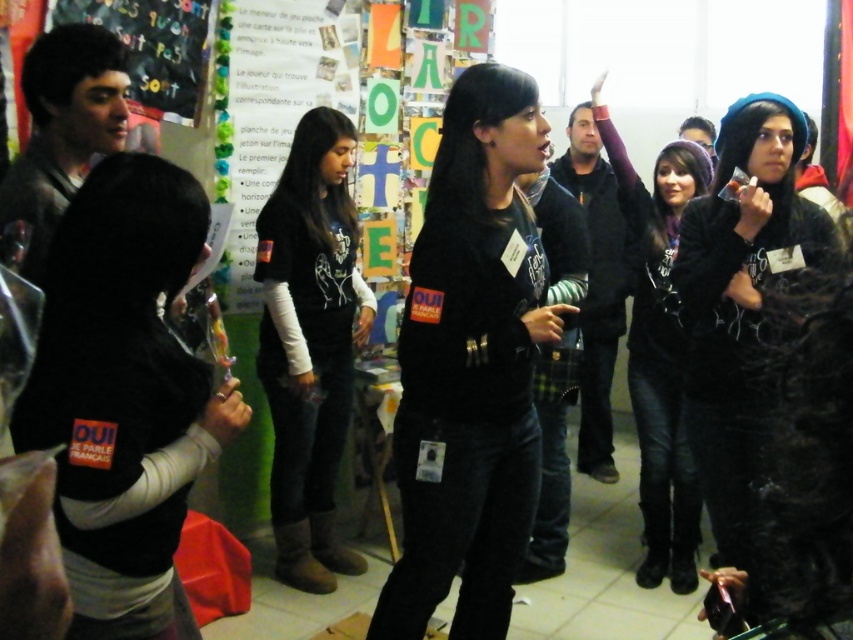
You are a photographer standing at the center of the room, and you want to take a photo that includes both the black matte vest at lower left and the velvet black hoodie at right. The camera you are using has a maximum horizontal field of view of 1.5 meters. Can you capture both objects in a single photo without moving the camera?

The black matte vest at lower left is 1.41 meters from the velvet black hoodie at right, which is within the camera maximum horizontal field of view of 1.5 meters. Therefore, you can capture both objects in a single photo without moving the camera.

You are organizing a photo shoot and need to place two jackets in the scene described. The black leather jacket at upper right and the dark blue jacket at center must be positioned according to their sizes. Which jacket should you place in a spot that requires less space?

The black leather jacket at upper right occupies less space than the dark blue jacket at center, so it should be placed in the spot that requires less space.

You are an attendee at this event and want to write a note on the matte black chalkboard at upper left. Can you easily access it from your current position in front of the black leather jacket at upper right?

The matte black chalkboard at upper left is behind the black leather jacket at upper right, so you would need to move around or step past the black leather jacket at upper right to access it.